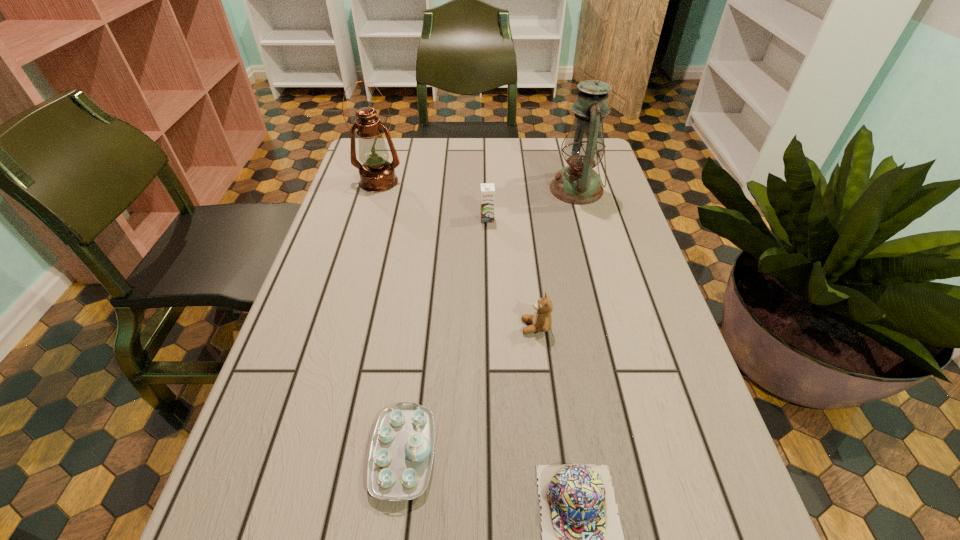
You are a GUI agent. You are given a task and a screenshot of the screen. Output one action in this format:
    pyautogui.click(x=<x>, y=<y>)
    Task: Click on the vacant space at the right edge
    The image size is (960, 540).
    Given the screenshot: What is the action you would take?
    [x=667, y=372]

Identify the location of vacant region between the chinaware and the leftmost object. (391, 318).

Locate an element on the screen. The image size is (960, 540). vacant space that's between the third farthest object and the right oil lamp is located at coordinates (532, 204).

This screenshot has height=540, width=960. Identify the location of free space between the third nearest object and the right oil lamp. (556, 258).

Find the location of `free spot between the fourth farthest object and the third object from left to right`. free spot between the fourth farthest object and the third object from left to right is located at coordinates (512, 273).

Locate an element on the screen. This screenshot has height=540, width=960. vacant point located between the fifth object from right to left and the right oil lamp is located at coordinates (x=490, y=321).

Identify the location of unoccupied area between the left oil lamp and the right oil lamp. The height and width of the screenshot is (540, 960). (478, 185).

Where is `free space between the fourth farthest object and the third farthest object`? free space between the fourth farthest object and the third farthest object is located at coordinates (512, 273).

This screenshot has width=960, height=540. What are the coordinates of `empty space between the fourth nearest object and the chinaware` in the screenshot? It's located at (445, 336).

This screenshot has height=540, width=960. I want to click on object that can be found as the third closest to the shortest object, so click(x=487, y=189).